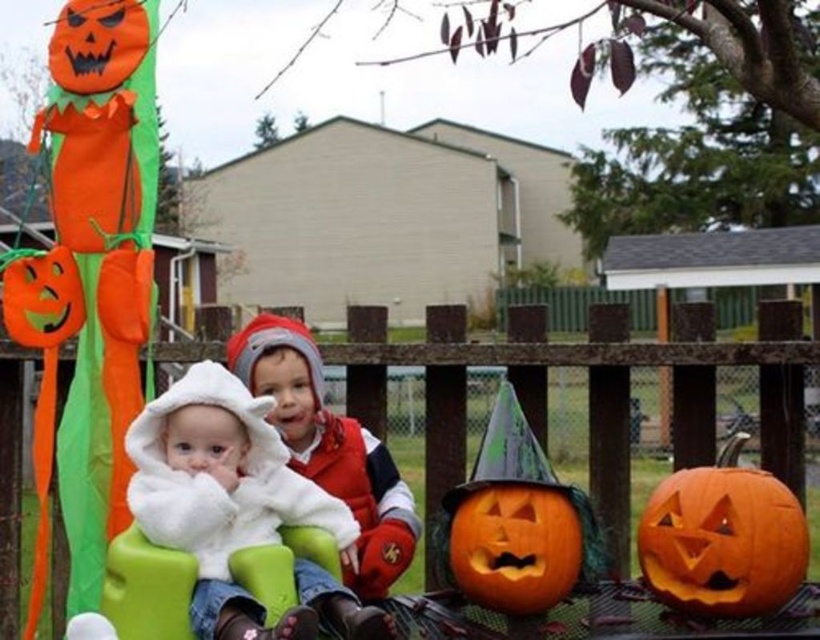
Question: Which point appears closest to the camera in this image?

Choices:
 (A) (538, 609)
 (B) (705, 592)
 (C) (280, 483)
 (D) (340, 467)

Answer: (C)

Question: Which point appears closest to the camera in this image?

Choices:
 (A) (201, 554)
 (B) (517, 577)
 (C) (311, 428)

Answer: (A)

Question: Does white fluffy coat at center appear on the right side of orange matte pumpkin at center?

Choices:
 (A) yes
 (B) no

Answer: (B)

Question: Observing the image, what is the correct spatial positioning of white fluffy coat at center in reference to white fleece hat at center?

Choices:
 (A) right
 (B) left

Answer: (A)

Question: Is white fluffy coat at center further to the viewer compared to white fleece hat at center?

Choices:
 (A) yes
 (B) no

Answer: (B)

Question: Which point is closer to the camera?

Choices:
 (A) white fluffy coat at center
 (B) orange matte pumpkin at lower right
 (C) orange matte pumpkin at center

Answer: (A)